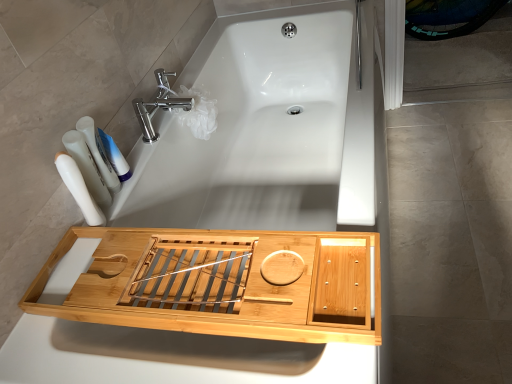
Locate an element on the screen. This screenshot has width=512, height=384. free area behind white matte toothpaste at upper left is located at coordinates point(146,151).